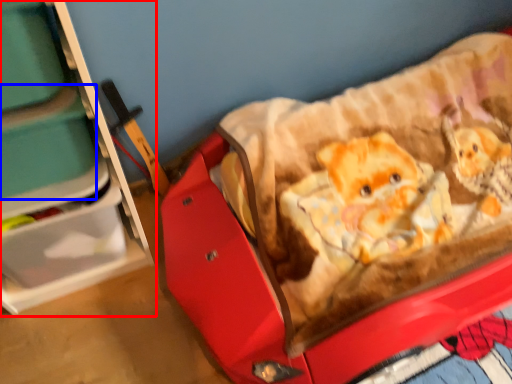
Question: Which of the following is the farthest to the observer, furniture (highlighted by a red box) or storage box (highlighted by a blue box)?

Choices:
 (A) furniture
 (B) storage box

Answer: (B)